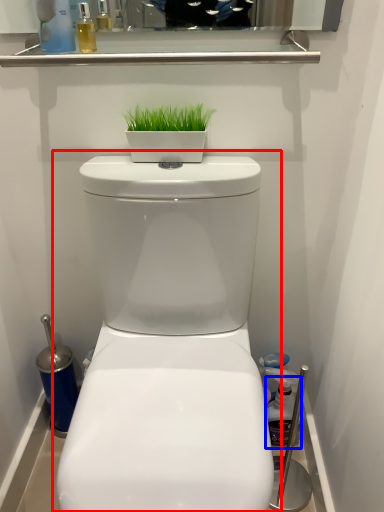
Question: Among these objects, which one is farthest to the camera, toilet (highlighted by a red box) or cleaning product (highlighted by a blue box)?

Choices:
 (A) toilet
 (B) cleaning product

Answer: (B)